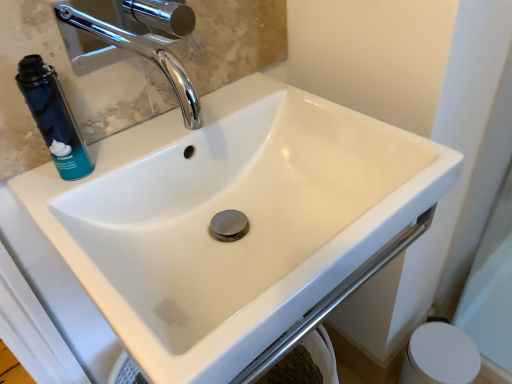
Identify the location of empty space that is ontop of white matte toilet paper at lower right (from a real-world perspective). This screenshot has width=512, height=384. (446, 356).